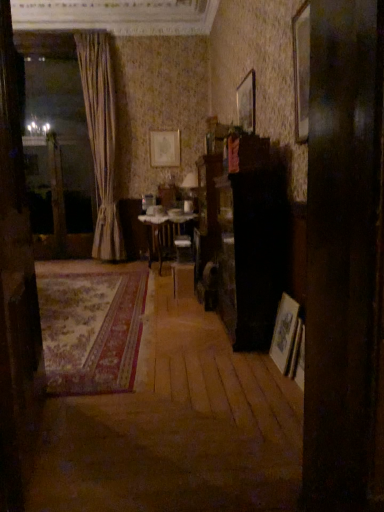
Locate an element on the screen. The image size is (384, 512). free space to the left of wooden picture frame at right, which is counted as the third picture frame, starting from the back is located at coordinates (254, 365).